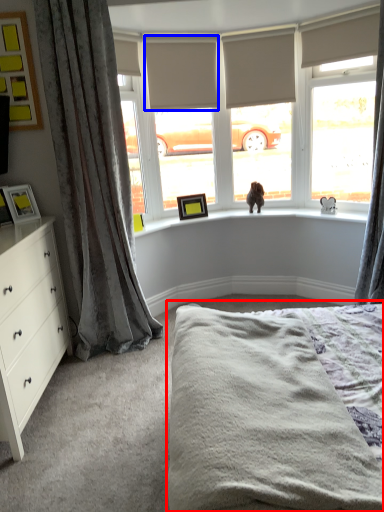
Question: Which point is closer to the camera, bed (highlighted by a red box) or blind (highlighted by a blue box)?

Choices:
 (A) bed
 (B) blind

Answer: (A)